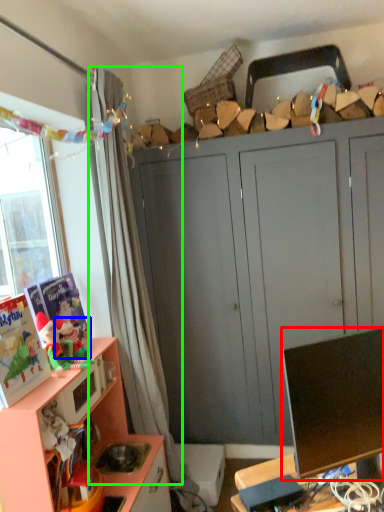
Question: Considering the real-world distances, which object is closest to television (highlighted by a red box)? toy (highlighted by a blue box) or curtain (highlighted by a green box).

Choices:
 (A) toy
 (B) curtain

Answer: (A)